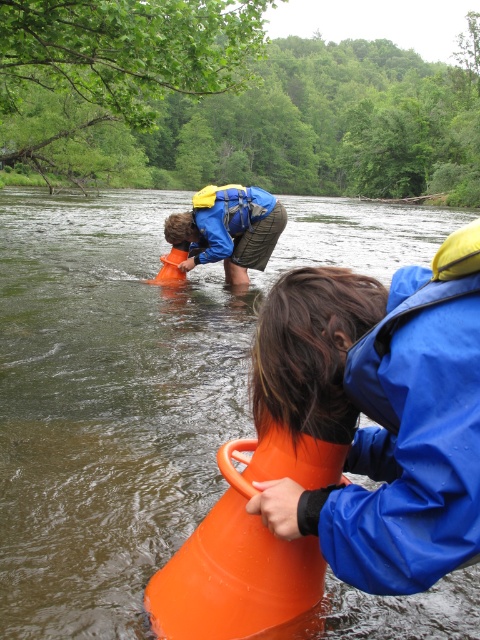
Question: Is blue waterproof jacket at lower right above matte blue jacket at center?

Choices:
 (A) yes
 (B) no

Answer: (B)

Question: Which point appears farthest from the camera in this image?

Choices:
 (A) (428, 262)
 (B) (395, 481)

Answer: (A)

Question: Does orange plastic cone at center have a lesser width compared to blue waterproof jacket at lower right?

Choices:
 (A) yes
 (B) no

Answer: (B)

Question: Does blue waterproof jacket at lower right appear over matte blue jacket at center?

Choices:
 (A) yes
 (B) no

Answer: (B)

Question: Which object is positioned closest to the blue waterproof jacket at lower right?

Choices:
 (A) orange plastic cone at center
 (B) matte blue jacket at center

Answer: (B)

Question: Which point is closer to the camera?

Choices:
 (A) matte blue jacket at center
 (B) orange plastic cone at center

Answer: (B)